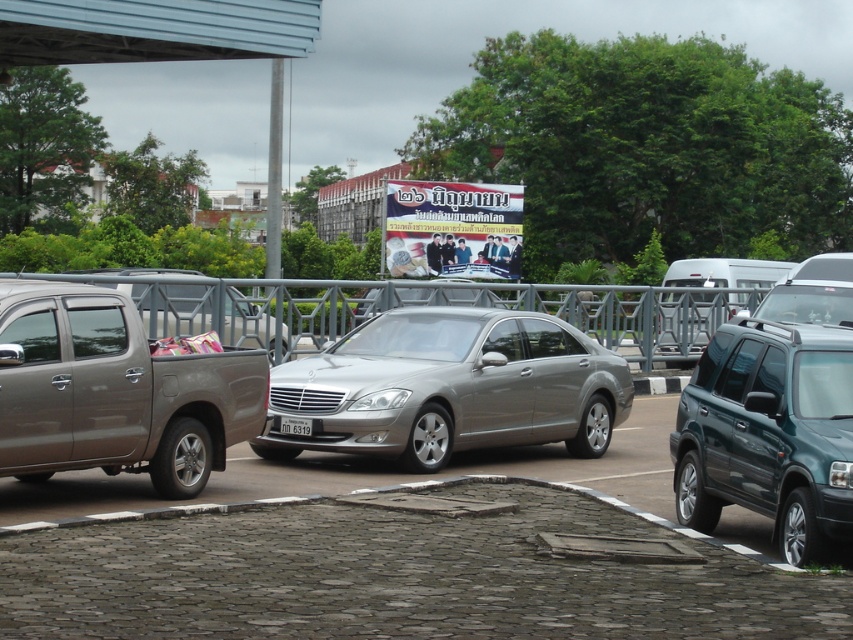
You are standing in the parking area and see two points marked on the ground. The first point is at coordinates point (245, 412) and the second is at point (683, 396). Which point is closer to you?

Point (245, 412) is closer to you because it is further to the viewer than point (683, 396).

You are standing in the parking area and want to know how far the point at coordinates (363, 342) is from your current position. Can you determine the distance?

The point at coordinates (363, 342) is 43.37 feet away from your current position.